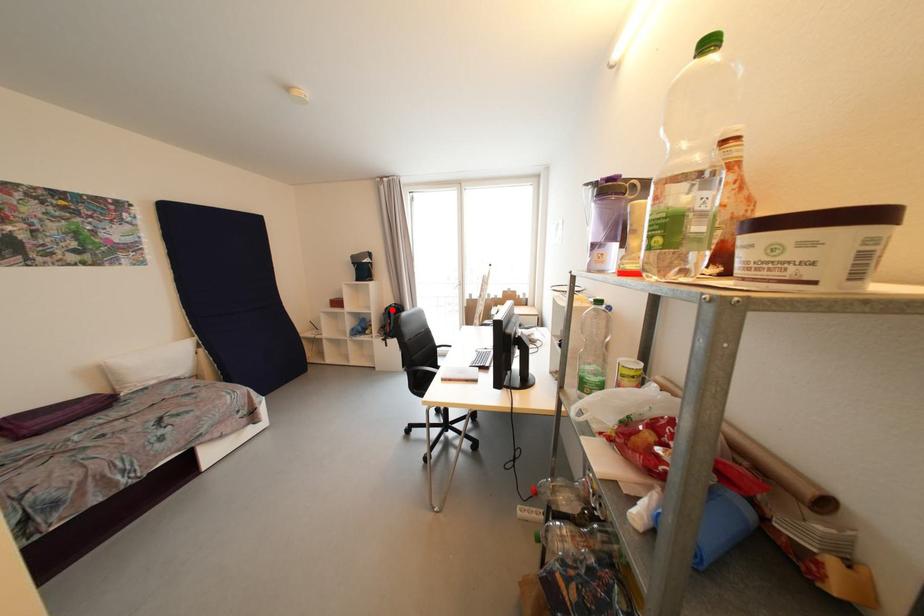
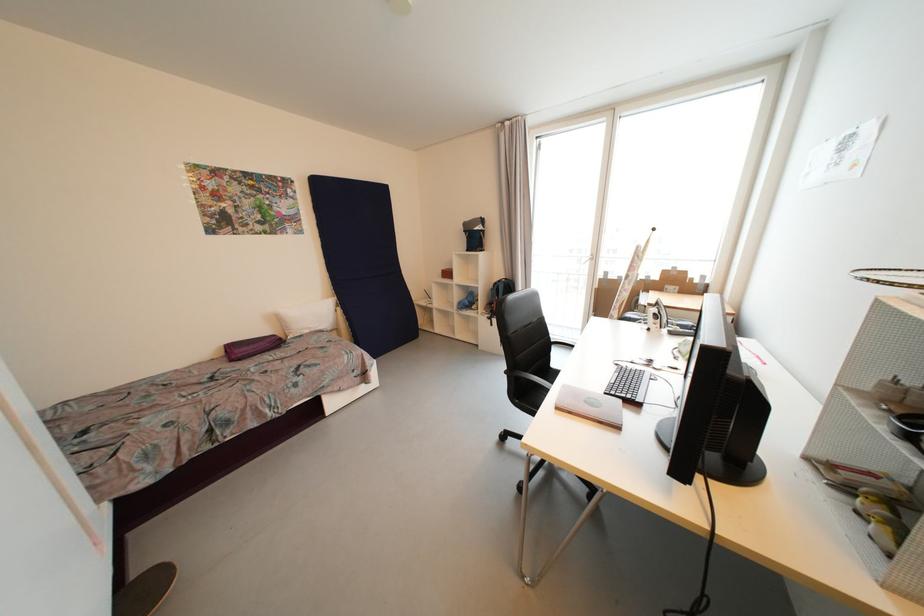
In the second image, find the point that corresponds to the highlighted location in the first image.

(501, 285)